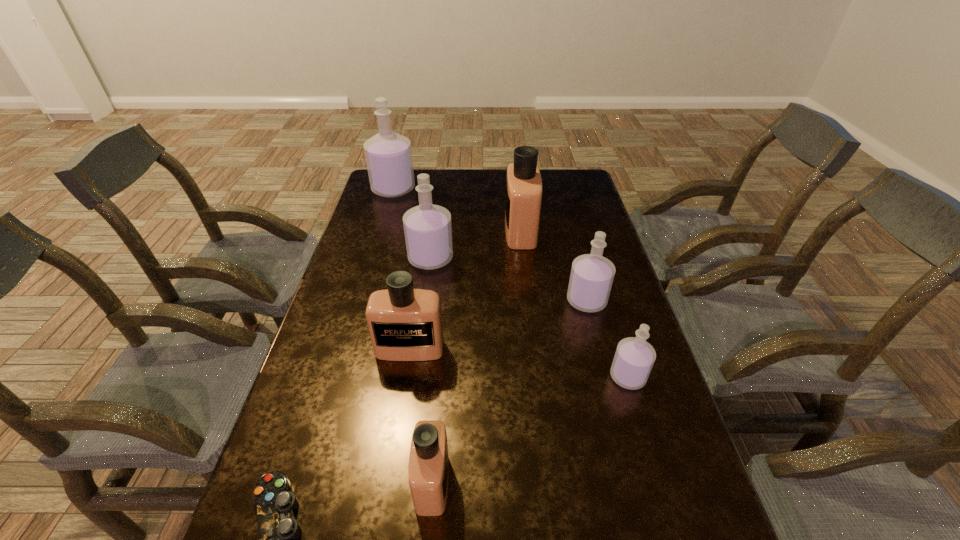
The image size is (960, 540). I want to click on the farthest perfume, so click(388, 155).

Locate an element on the screen. The height and width of the screenshot is (540, 960). the farthest purple perfume is located at coordinates (388, 155).

Find the location of a particular element. the third perfume from right to left is located at coordinates (523, 199).

The image size is (960, 540). What are the coordinates of `the biggest beige perfume` in the screenshot? It's located at tap(523, 199).

Where is `the third smallest purple perfume`? the third smallest purple perfume is located at coordinates (428, 232).

Where is `the third purple perfume from right to left`? the third purple perfume from right to left is located at coordinates pyautogui.click(x=428, y=232).

I want to click on the fourth farthest object, so click(x=591, y=278).

Identify the location of the third farthest purple perfume. (591, 278).

Image resolution: width=960 pixels, height=540 pixels. I want to click on the fifth farthest object, so click(x=405, y=324).

Identify the location of the second biggest beige perfume. This screenshot has width=960, height=540. click(x=405, y=324).